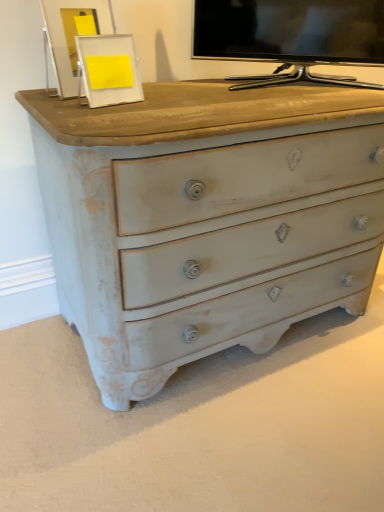
The image size is (384, 512). I want to click on matte black tv at upper center, so click(x=293, y=33).

Describe the element at coordinates (293, 33) in the screenshot. The image size is (384, 512). I see `matte black tv at upper center` at that location.

Locate an element on the screen. This screenshot has width=384, height=512. white matte picture frame at upper center is located at coordinates (109, 69).

This screenshot has height=512, width=384. What do you see at coordinates (109, 69) in the screenshot?
I see `white matte picture frame at upper center` at bounding box center [109, 69].

The height and width of the screenshot is (512, 384). I want to click on matte black tv at upper center, so click(293, 33).

Can you confirm if matte black tv at upper center is positioned to the left of white matte picture frame at upper center?

Incorrect, matte black tv at upper center is not on the left side of white matte picture frame at upper center.

Which is in front, matte black tv at upper center or white matte picture frame at upper center?

white matte picture frame at upper center is more forward.

Considering the points (270, 42) and (120, 37), which point is behind, point (270, 42) or point (120, 37)?

Point (270, 42)

From the image's perspective, which one is positioned lower, matte black tv at upper center or white matte picture frame at upper center?

white matte picture frame at upper center.

From a real-world perspective, which is physically above, matte black tv at upper center or white matte picture frame at upper center?

matte black tv at upper center.

Is matte black tv at upper center thinner than white matte picture frame at upper center?

Incorrect, the width of matte black tv at upper center is not less than that of white matte picture frame at upper center.

Considering the sizes of objects matte black tv at upper center and white matte picture frame at upper center in the image provided, who is shorter, matte black tv at upper center or white matte picture frame at upper center?

Standing shorter between the two is white matte picture frame at upper center.

Is matte black tv at upper center smaller than white matte picture frame at upper center?

No.

Could white matte picture frame at upper center be considered to be inside matte black tv at upper center?

No.

Would you say matte black tv at upper center is a long distance from white matte picture frame at upper center?

No, there isn't a large distance between matte black tv at upper center and white matte picture frame at upper center.

Does matte black tv at upper center turn towards white matte picture frame at upper center?

Yes, matte black tv at upper center is oriented towards white matte picture frame at upper center.

How many degrees apart are the facing directions of matte black tv at upper center and white matte picture frame at upper center?

matte black tv at upper center and white matte picture frame at upper center are facing 50.1 degrees away from each other.

At what (x,y) coordinates should I click in order to perform the action: click on television positioned vertically above the white matte picture frame at upper center (from a real-world perspective). Please return your answer as a coordinate pair (x, y). Looking at the image, I should click on (293, 33).

In the scene shown: Can you confirm if white matte picture frame at upper center is positioned to the right of matte black tv at upper center?

In fact, white matte picture frame at upper center is to the left of matte black tv at upper center.

Between white matte picture frame at upper center and matte black tv at upper center, which one is positioned in front?

white matte picture frame at upper center is in front.

Which is nearer, (125, 59) or (324, 55)?

Point (125, 59) is closer to the camera than point (324, 55).

From the image's perspective, which one is positioned higher, white matte picture frame at upper center or matte black tv at upper center?

From the image's view, matte black tv at upper center is above.

From a real-world perspective, is white matte picture frame at upper center beneath matte black tv at upper center?

Yes.

In terms of width, does white matte picture frame at upper center look wider or thinner when compared to matte black tv at upper center?

Clearly, white matte picture frame at upper center has less width compared to matte black tv at upper center.

Considering the sizes of white matte picture frame at upper center and matte black tv at upper center in the image, is white matte picture frame at upper center taller or shorter than matte black tv at upper center?

Clearly, white matte picture frame at upper center is shorter compared to matte black tv at upper center.

Is white matte picture frame at upper center smaller than matte black tv at upper center?

Correct, white matte picture frame at upper center occupies less space than matte black tv at upper center.

Would you say white matte picture frame at upper center is inside or outside matte black tv at upper center?

white matte picture frame at upper center is not enclosed by matte black tv at upper center.

Would you consider white matte picture frame at upper center to be distant from matte black tv at upper center?

That's not correct — white matte picture frame at upper center is a little close to matte black tv at upper center.

Is white matte picture frame at upper center facing towards matte black tv at upper center?

No, white matte picture frame at upper center is not facing towards matte black tv at upper center.

What's the angular difference between white matte picture frame at upper center and matte black tv at upper center's facing directions?

50.1 degrees.

Locate an element on the screen. The width and height of the screenshot is (384, 512). picture frame located on the left of matte black tv at upper center is located at coordinates (109, 69).

What are the coordinates of `picture frame that is below the matte black tv at upper center (from the image's perspective)` in the screenshot? It's located at (109, 69).

Find the location of a particular element. The height and width of the screenshot is (512, 384). picture frame located on the left of matte black tv at upper center is located at coordinates (109, 69).